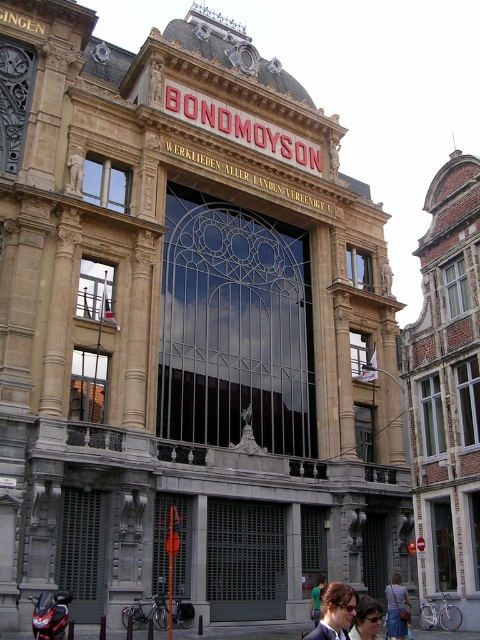
Question: Does dark brown hair at center appear over denim jacket at lower right?

Choices:
 (A) no
 (B) yes

Answer: (B)

Question: Which point is closer to the camera?

Choices:
 (A) dark brown hair at center
 (B) matte black sunglasses at lower center

Answer: (A)

Question: Does dark brown hair at center come in front of matte black sunglasses at lower center?

Choices:
 (A) yes
 (B) no

Answer: (A)

Question: Can you confirm if denim jacket at lower right is positioned above matte black sunglasses at lower center?

Choices:
 (A) yes
 (B) no

Answer: (B)

Question: Which of the following is the closest to the observer?

Choices:
 (A) (352, 625)
 (B) (396, 593)
 (C) (342, 616)

Answer: (C)

Question: Which point is farther to the camera?

Choices:
 (A) denim jacket at lower right
 (B) matte black sunglasses at lower center

Answer: (A)